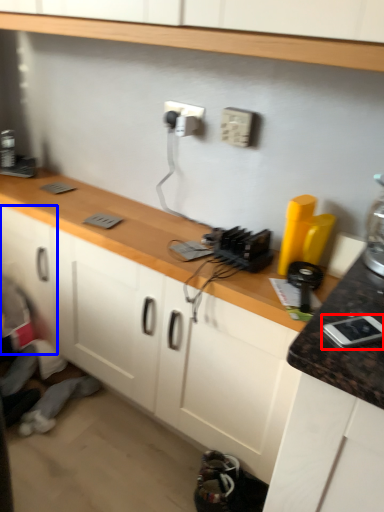
Question: Which object is closer to the camera taking this photo, appliance (highlighted by a red box) or cabinetry (highlighted by a blue box)?

Choices:
 (A) appliance
 (B) cabinetry

Answer: (A)